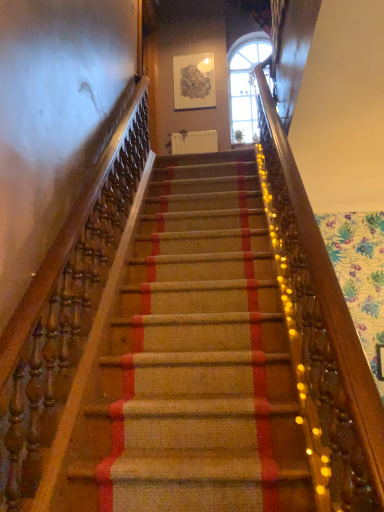
Identify the location of metallic silver picture frame at upper center. The image size is (384, 512). (194, 82).

Describe the element at coordinates (194, 82) in the screenshot. I see `metallic silver picture frame at upper center` at that location.

Identify the location of metallic silver picture frame at upper center. This screenshot has width=384, height=512. (194, 82).